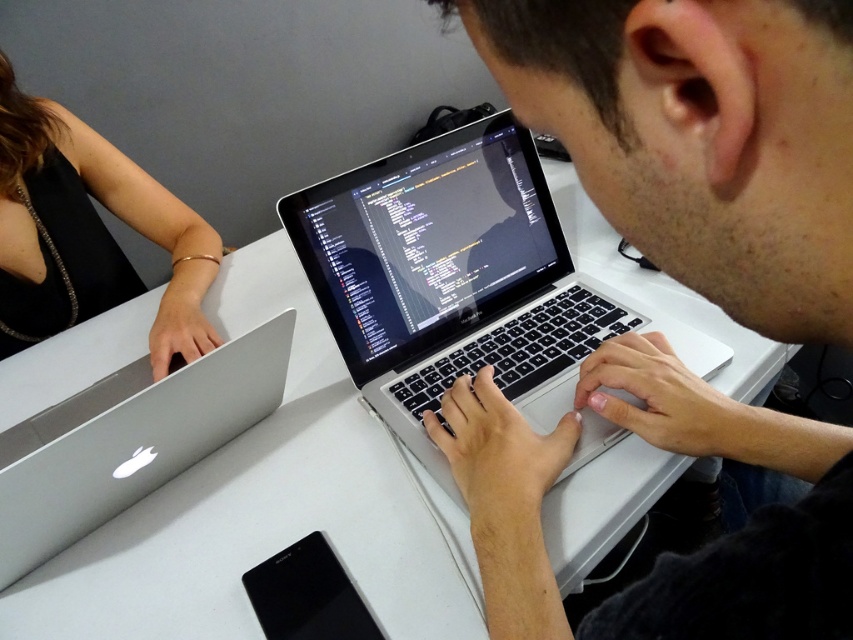
You are a robotic assistant that needs to place a new laptop on the table. The table has limited space between the black fabric arm at upper left and the silver metallic laptop at left. Can you fit the new laptop between them if the new laptop is 10 cm wide?

The black fabric arm at upper left is wider than the silver metallic laptop at left. However, the exact widths aren